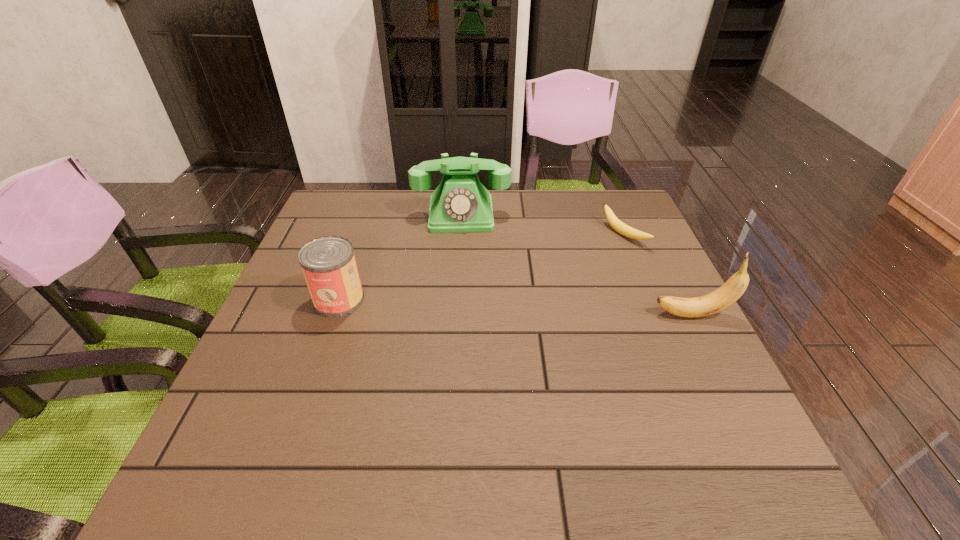
In the image, there is a desktop. Where is `blank space at the far edge`? The width and height of the screenshot is (960, 540). blank space at the far edge is located at coordinates (513, 220).

Find the location of a particular element. The width and height of the screenshot is (960, 540). vacant space at the near edge of the desktop is located at coordinates (512, 400).

The image size is (960, 540). Find the location of `vacant space at the right edge of the desktop`. vacant space at the right edge of the desktop is located at coordinates (618, 287).

Where is `free point at the far left corner`? free point at the far left corner is located at coordinates (345, 202).

Locate an element on the screen. vacant space at the far right corner of the desktop is located at coordinates (592, 204).

In the image, there is a desktop. Identify the location of vacant space at the near right corner. The height and width of the screenshot is (540, 960). (715, 424).

Identify the location of vacant space that is in between the farther banana and the can. (481, 267).

Identify the location of empty space that is in between the leftmost object and the telephone. The height and width of the screenshot is (540, 960). (400, 257).

The height and width of the screenshot is (540, 960). What are the coordinates of `free spot between the shorter banana and the can` in the screenshot? It's located at (481, 267).

The width and height of the screenshot is (960, 540). I want to click on empty space that is in between the can and the telephone, so click(x=400, y=257).